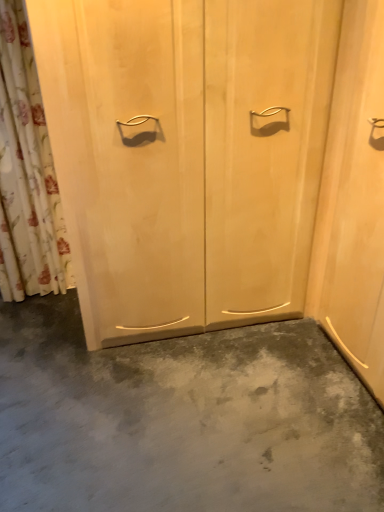
Locate an element on the screen. The width and height of the screenshot is (384, 512). vacant space situated on the left part of light wood/texture door at center is located at coordinates (47, 349).